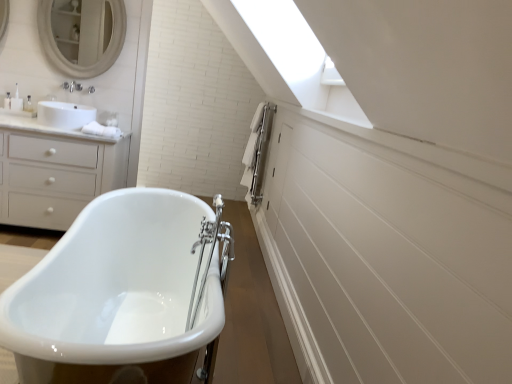
Question: Considering the relative sizes of white matte mirror at upper left and white glossy bathtub at center in the image provided, is white matte mirror at upper left wider than white glossy bathtub at center?

Choices:
 (A) no
 (B) yes

Answer: (A)

Question: From a real-world perspective, does white matte mirror at upper left sit lower than white glossy bathtub at center?

Choices:
 (A) yes
 (B) no

Answer: (B)

Question: Can you confirm if white matte mirror at upper left is bigger than white glossy bathtub at center?

Choices:
 (A) yes
 (B) no

Answer: (B)

Question: From the image's perspective, is white matte mirror at upper left beneath white glossy bathtub at center?

Choices:
 (A) yes
 (B) no

Answer: (B)

Question: Is white glossy bathtub at center inside white matte mirror at upper left?

Choices:
 (A) yes
 (B) no

Answer: (B)

Question: Relative to white glossy bathtub at center, is white matte chest of drawers at left in front or behind?

Choices:
 (A) front
 (B) behind

Answer: (B)

Question: From a real-world perspective, is white matte chest of drawers at left above or below white glossy bathtub at center?

Choices:
 (A) above
 (B) below

Answer: (A)

Question: Considering the positions of white matte chest of drawers at left and white glossy bathtub at center in the image, is white matte chest of drawers at left taller or shorter than white glossy bathtub at center?

Choices:
 (A) short
 (B) tall

Answer: (B)

Question: From the image's perspective, relative to white glossy bathtub at center, is white matte chest of drawers at left above or below?

Choices:
 (A) below
 (B) above

Answer: (B)

Question: Is white glossy bathtub at center bigger or smaller than white matte chest of drawers at left?

Choices:
 (A) big
 (B) small

Answer: (A)

Question: Considering the positions of white glossy bathtub at center and white matte chest of drawers at left in the image, is white glossy bathtub at center taller or shorter than white matte chest of drawers at left?

Choices:
 (A) short
 (B) tall

Answer: (A)

Question: Is white glossy bathtub at center in front of or behind white matte chest of drawers at left in the image?

Choices:
 (A) front
 (B) behind

Answer: (A)

Question: Is white glossy bathtub at center inside or outside of white matte chest of drawers at left?

Choices:
 (A) inside
 (B) outside

Answer: (B)

Question: From a real-world perspective, is white matte mirror at upper left positioned above or below white matte chest of drawers at left?

Choices:
 (A) above
 (B) below

Answer: (A)

Question: Considering their positions, is white matte mirror at upper left located in front of or behind white matte chest of drawers at left?

Choices:
 (A) behind
 (B) front

Answer: (A)